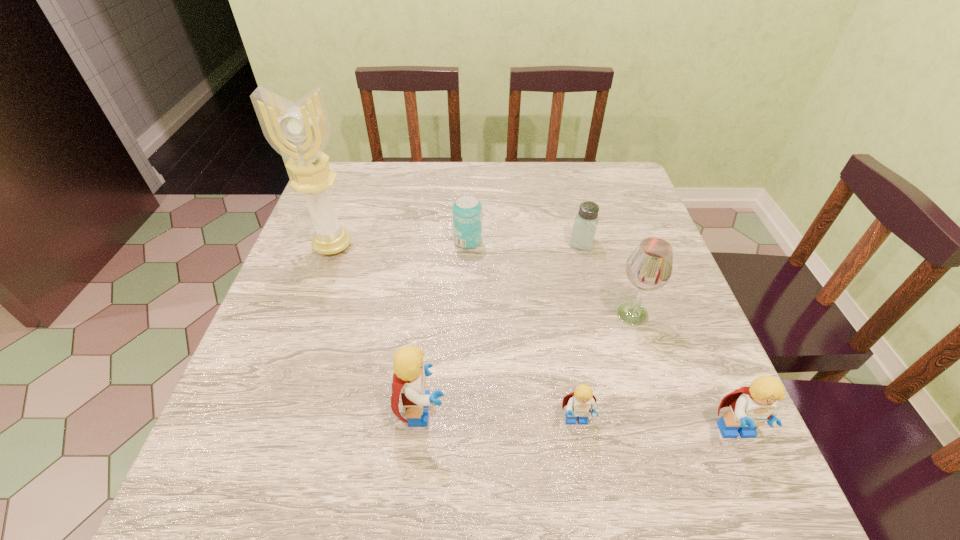
Where is `free space for a new Lego on the left`? This screenshot has height=540, width=960. free space for a new Lego on the left is located at coordinates (275, 399).